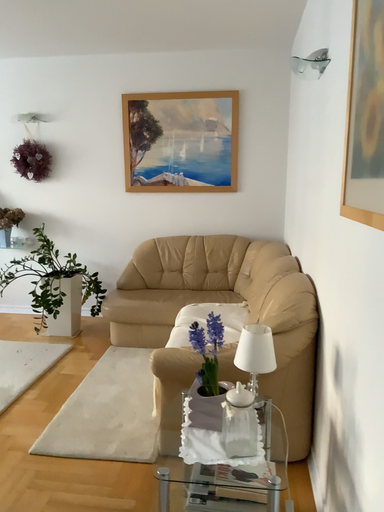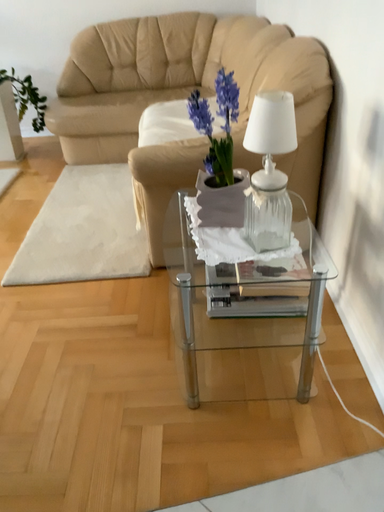
Question: How did the camera likely rotate when shooting the video?

Choices:
 (A) rotated downward
 (B) rotated upward

Answer: (A)